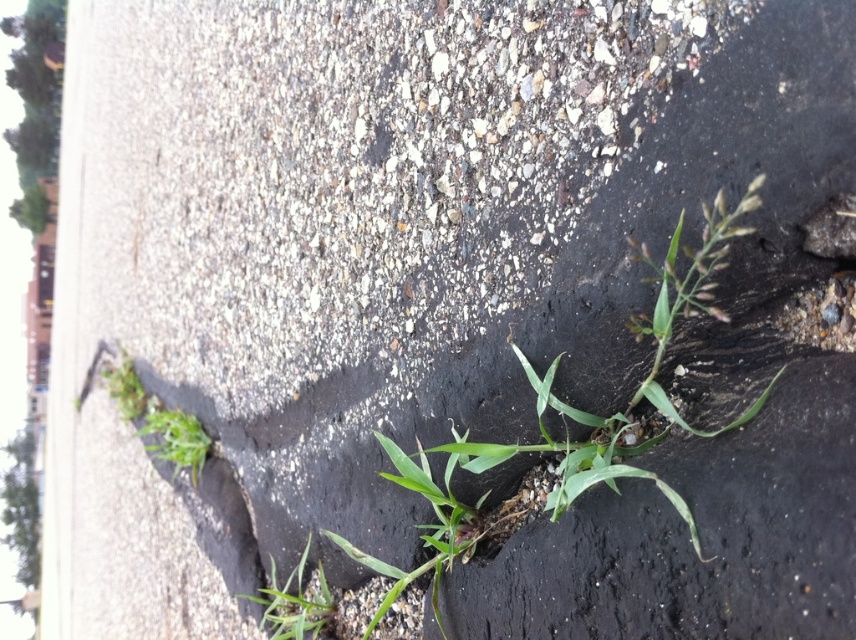
Who is lower down, green leafy plant at lower center or green leafy plant at lower left?

green leafy plant at lower center

Does green leafy plant at lower center have a lesser width compared to green leafy plant at lower left?

Yes.

Is point (272, 564) farther from camera compared to point (159, 435)?

No, it is in front of (159, 435).

You are a GUI agent. You are given a task and a screenshot of the screen. Output one action in this format:
    pyautogui.click(x=<x>, y=<y>)
    Task: Click on the green leafy plant at lower center
    The width and height of the screenshot is (856, 640).
    Given the screenshot: What is the action you would take?
    pyautogui.click(x=295, y=602)